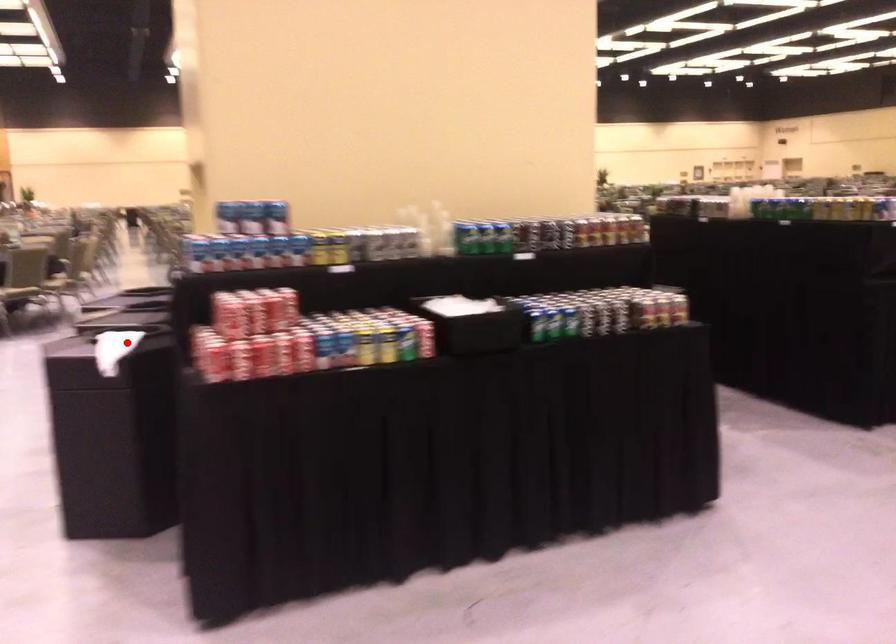
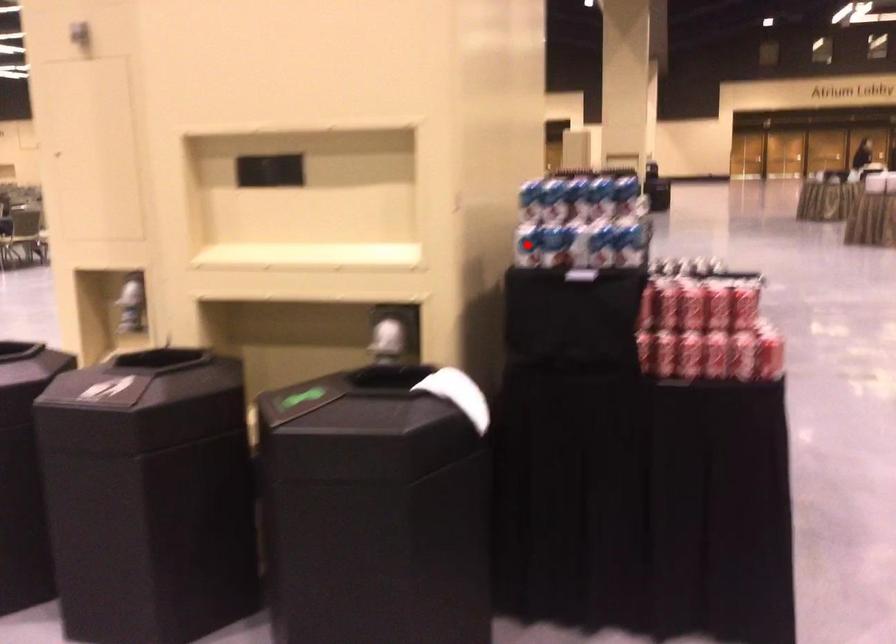
I am providing you with two images of the same scene from different viewpoints. A red point is marked on the first image and another point is marked on the second image. Is the red point in image1 aligned with the point shown in image2?

No